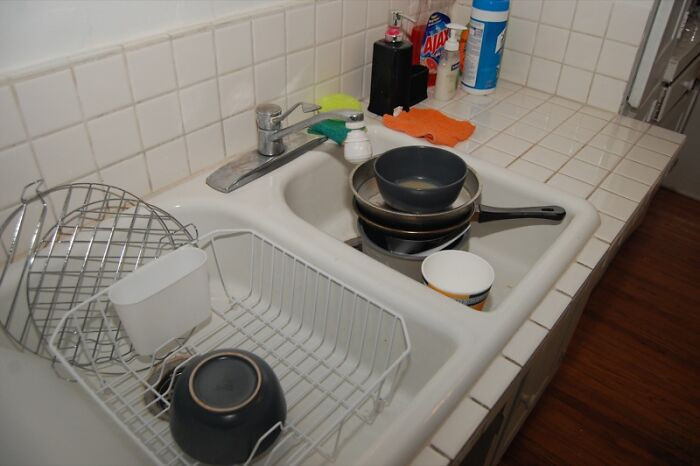
Locate an element on the screen. This screenshot has height=466, width=700. drying rack is located at coordinates (368, 359).